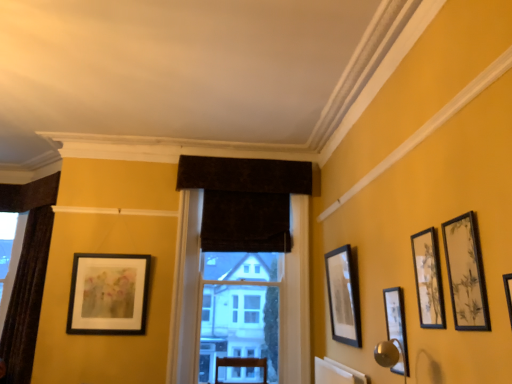
Question: Considering the positions of matte black picture frame at right, placed as the third picture frame when sorted from right to left, and dark velvet curtain at center in the image, is matte black picture frame at right, placed as the third picture frame when sorted from right to left, wider or thinner than dark velvet curtain at center?

Choices:
 (A) thin
 (B) wide

Answer: (A)

Question: Based on their positions, is matte black picture frame at right, the third picture frame viewed from the back, located to the left or right of dark velvet curtain at center?

Choices:
 (A) right
 (B) left

Answer: (A)

Question: Which of these objects is positioned closest to the matte black picture frame at center right, positioned as the fourth picture frame in right-to-left order?

Choices:
 (A) dark velvet curtain at center
 (B) matte black picture frame at upper right, the 5th picture frame positioned from the back
 (C) velvet dark brown curtain at center
 (D) velvet dark brown curtain at center, positioned as the second window in back-to-front order
 (E) matte black picture frame at left, which ranks as the 5th picture frame in front-to-back order

Answer: (D)

Question: Which of these objects is positioned closest to the matte black picture frame at upper right, arranged as the 4th picture frame when viewed from the back?

Choices:
 (A) dark brown velvet curtain at left, arranged as the 2th window when viewed from the right
 (B) velvet dark brown curtain at center
 (C) velvet dark brown curtain at center, which is the 1th window from front to back
 (D) matte black picture frame at upper right, the 5th picture frame positioned from the back
 (E) matte black picture frame at right, which is the third picture frame from front to back

Answer: (D)